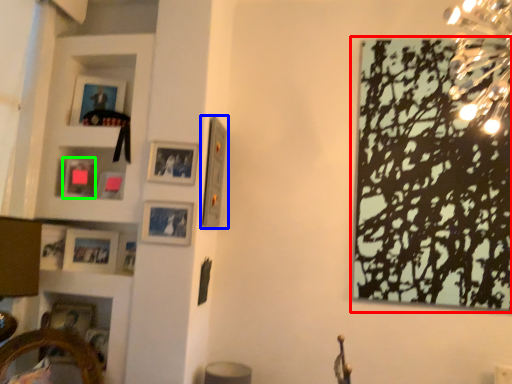
Question: Which is nearer to the picture frame (highlighted by a red box)? picture frame (highlighted by a blue box) or picture frame (highlighted by a green box).

Choices:
 (A) picture frame
 (B) picture frame

Answer: (A)